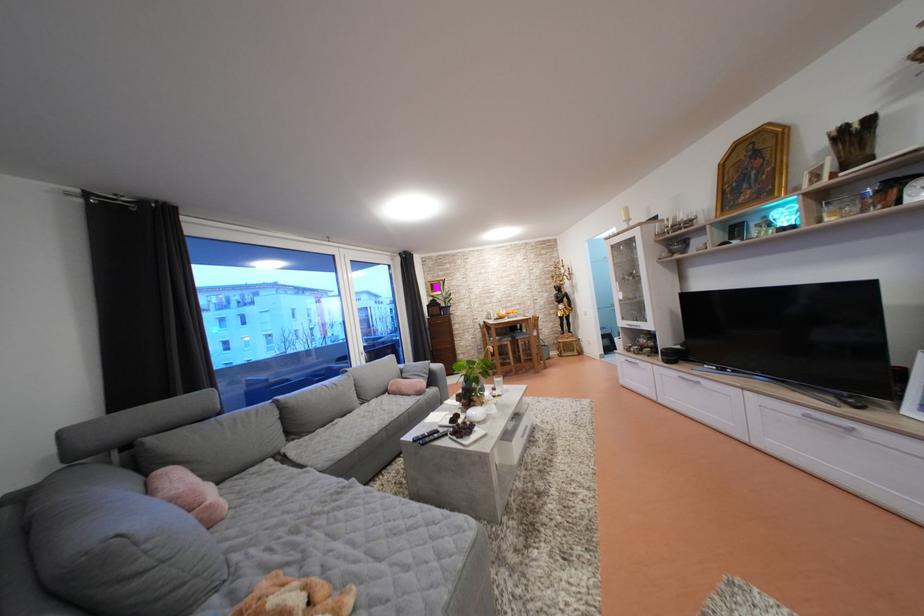
The width and height of the screenshot is (924, 616). Find the location of `sliding door handle`. sliding door handle is located at coordinates (628, 362).